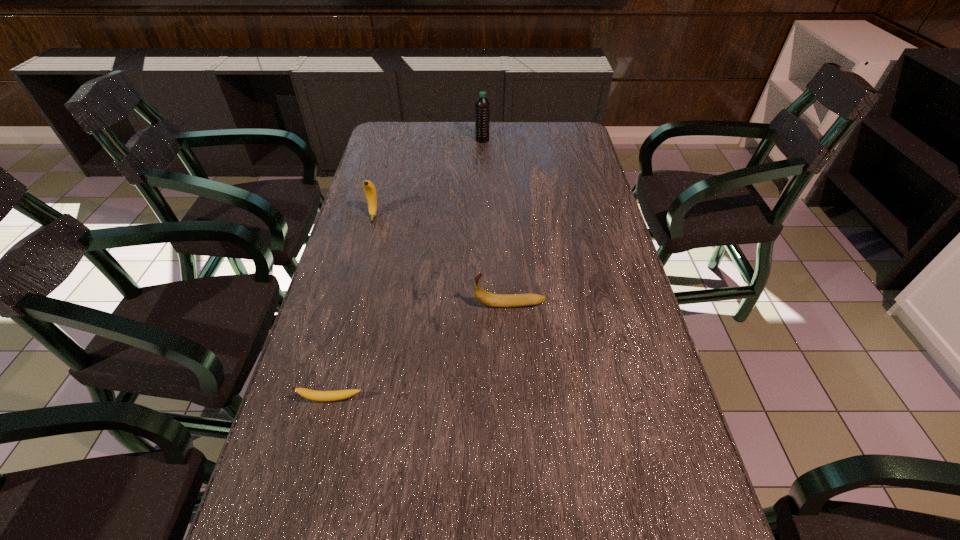
Where is `free space between the third tallest object and the farthest object`? The width and height of the screenshot is (960, 540). free space between the third tallest object and the farthest object is located at coordinates (496, 222).

I want to click on empty space between the shortest object and the farthest object, so click(407, 269).

This screenshot has height=540, width=960. Identify the location of empty space between the second shortest object and the tallest object. (496, 222).

Image resolution: width=960 pixels, height=540 pixels. I want to click on free point between the rightmost banana and the farthest banana, so click(442, 260).

Where is `empty space between the tallest object and the shortest banana`? The image size is (960, 540). empty space between the tallest object and the shortest banana is located at coordinates (407, 269).

The image size is (960, 540). Find the location of `unoccupied position between the farthest banana and the water bottle`. unoccupied position between the farthest banana and the water bottle is located at coordinates (428, 178).

Locate an element on the screen. vacant space in between the nearest banana and the second shortest object is located at coordinates (420, 352).

The height and width of the screenshot is (540, 960). In order to click on vacant space in between the farthest object and the farthest banana in this screenshot , I will do `click(428, 178)`.

Where is `unoccupied position between the second farthest banana and the third nearest object`? The image size is (960, 540). unoccupied position between the second farthest banana and the third nearest object is located at coordinates (442, 260).

In order to click on the third closest object to the tallest object in this screenshot , I will do `click(322, 396)`.